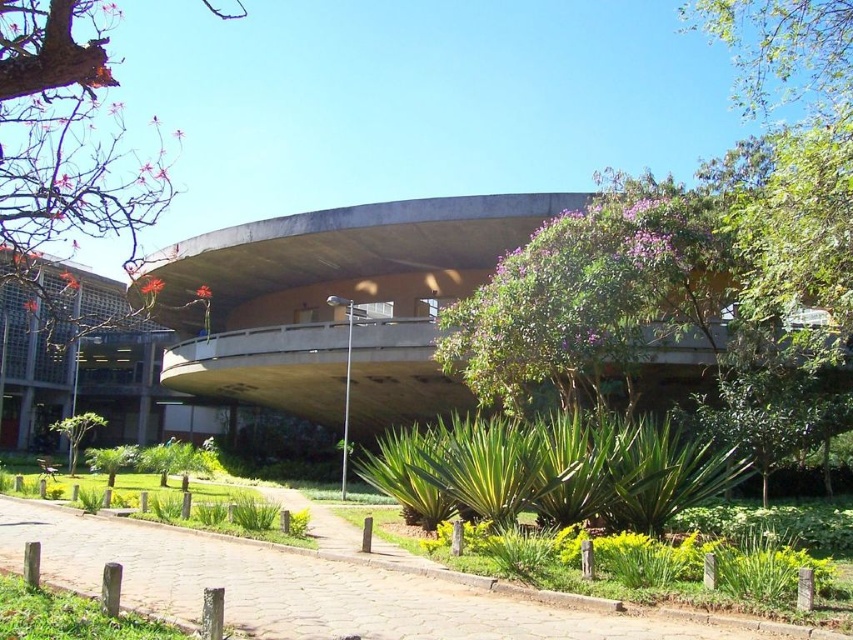
Question: In this image, where is brown cobblestone path at center located relative to smooth bark tree at left?

Choices:
 (A) right
 (B) left

Answer: (A)

Question: Which point is farther to the camera?

Choices:
 (A) brown cobblestone path at center
 (B) green leafy tree at lower left

Answer: (B)

Question: Among these objects, which one is nearest to the camera?

Choices:
 (A) brown cobblestone path at center
 (B) purple leafy tree at center

Answer: (A)

Question: Is purple leafy tree at center wider than green leafy tree at lower left?

Choices:
 (A) no
 (B) yes

Answer: (A)

Question: Which object is positioned farthest from the smooth bark tree at left?

Choices:
 (A) purple leafy tree at center
 (B) green leafy tree at lower left
 (C) brown cobblestone path at center

Answer: (B)

Question: In this image, where is brown cobblestone path at center located relative to green leafy tree at lower left?

Choices:
 (A) right
 (B) left

Answer: (A)